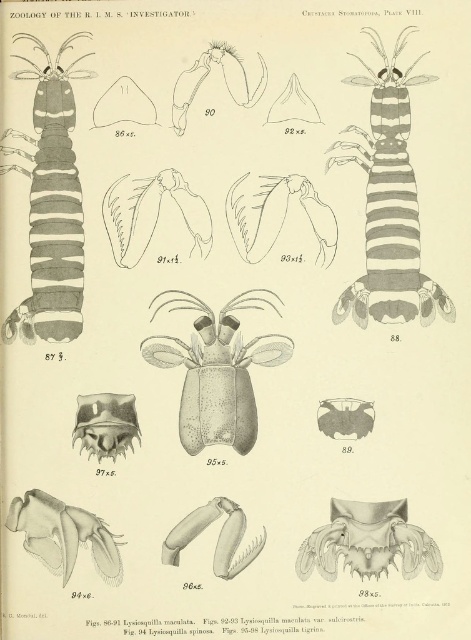
Based on the illustration from the zoological publication, if you were to measure the distance from your current viewpoint to the point labeled at coordinates (406, 173), what would it be?

The point labeled at coordinates (406, 173) is 3.77 feet away from the viewer.

You are a researcher examining the illustration and need to determine the spatial arrangement of the striped paper shrimp at upper right and the striped paper shrimp at left. Which one is closer to the viewer?

The striped paper shrimp at upper right is closer to the viewer because the striped paper shrimp at left is behind it.